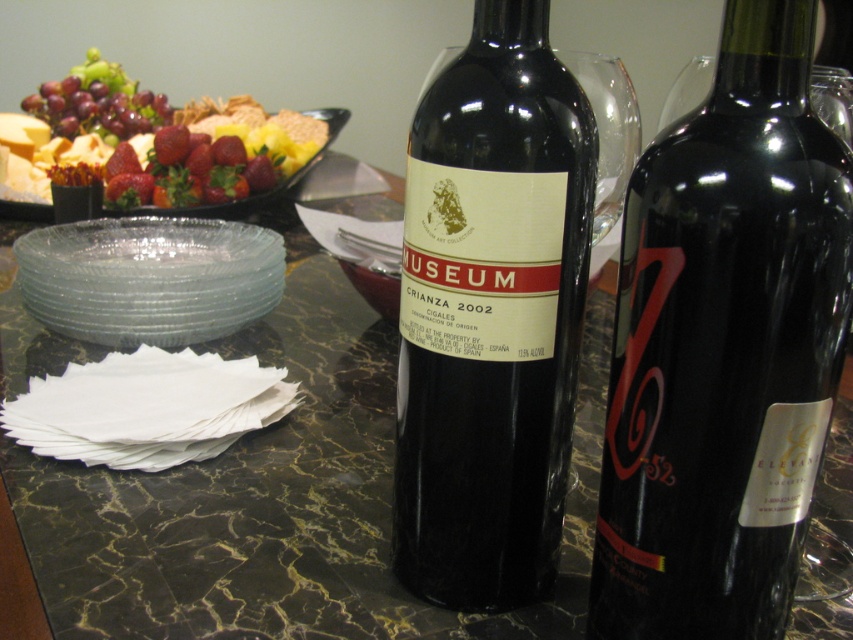
You are arranging a fruit platter and need to place the shiny red strawberries at upper left and the shiny red grapes at upper left on the table. Based on their positions, which fruit is closer to the left edge of the table?

The shiny red grapes at upper left are closer to the left edge of the table because the shiny red strawberries at upper left are positioned to the right of them.

You are arranging a dinner party and need to place a decorative centerpiece on the dining table. The table has a dark marble surface with black and gold tones. You have a shiny red grapes at upper left on the table. Where should you place the centerpiece to avoid covering the grapes?

The shiny red grapes at upper left are located at point (x=97, y=102) on the table. To avoid covering them, place the centerpiece in an area of the table surface that does not overlap with this coordinate.

You are a server at a restaurant and need to place a 12 inch long decorative ribbon between the shiny red grapes at upper left and the glassy clear platter at upper left. Can you fit the ribbon between them without it hanging off either side?

The distance between the shiny red grapes at upper left and the glassy clear platter at upper left is 13.37 inches. Since the ribbon is 12 inches long, it can fit between them with some space to spare.